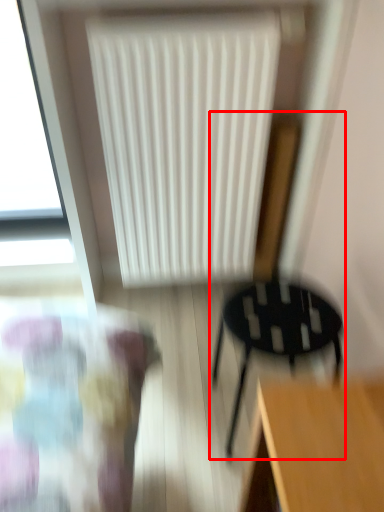
Question: From the image, what is the correct spatial relationship of chair (annotated by the red box) in relation to radiator?

Choices:
 (A) right
 (B) left

Answer: (A)